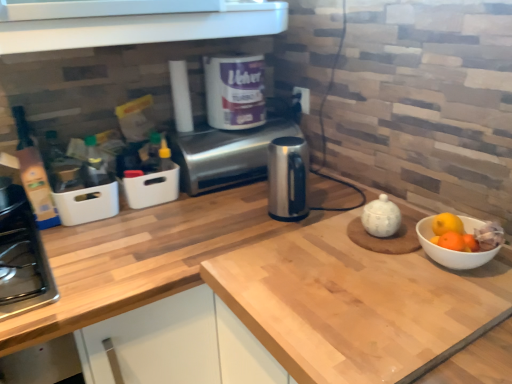
Question: From the image's perspective, relative to satin silver toaster at center, is black plastic electric outlet at upper center above or below?

Choices:
 (A) above
 (B) below

Answer: (A)

Question: Does point (300, 91) appear closer or farther from the camera than point (297, 129)?

Choices:
 (A) farther
 (B) closer

Answer: (B)

Question: Which object is the farthest from the white glossy tea pot at center-right?

Choices:
 (A) black plastic electric outlet at upper center
 (B) satin silver toaster at center
 (C) light wood countertop at center

Answer: (A)

Question: Which of these objects is positioned closest to the white glossy tea pot at center-right?

Choices:
 (A) black plastic electric outlet at upper center
 (B) light wood countertop at center
 (C) satin silver toaster at center

Answer: (B)